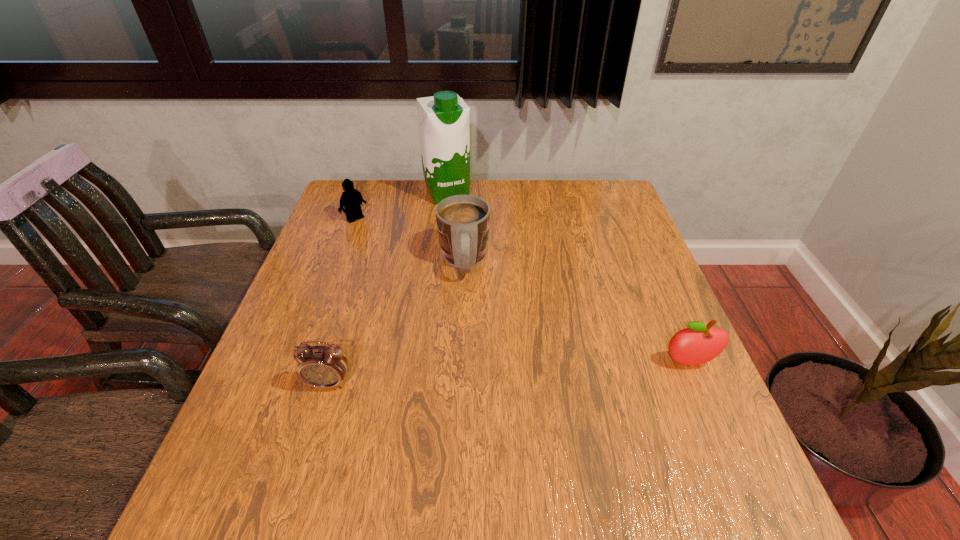
At what (x,y) coordinates should I click in order to perform the action: click on vacant space on the desktop that is between the alarm clock and the fourth farthest object and is positioned on the side of the third nearest object with the handle. Please return your answer as a coordinate pair (x, y). Looking at the image, I should click on (473, 375).

Where is `free spot on the desktop that is between the alarm clock and the fourth farthest object and is positioned on the face of the second farthest object`? Image resolution: width=960 pixels, height=540 pixels. free spot on the desktop that is between the alarm clock and the fourth farthest object and is positioned on the face of the second farthest object is located at coordinates coord(530,372).

Find the location of a particular element. This screenshot has width=960, height=540. free space on the desktop that is between the nearest object and the rightmost object and is positioned on the front-facing side of the soya milk is located at coordinates (547, 370).